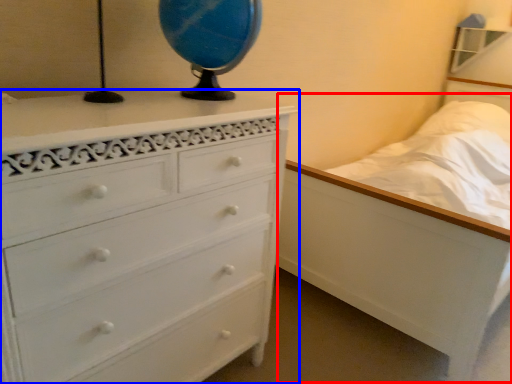
Question: Which of the following is the farthest to the observer, bed (highlighted by a red box) or chest of drawers (highlighted by a blue box)?

Choices:
 (A) bed
 (B) chest of drawers

Answer: (A)